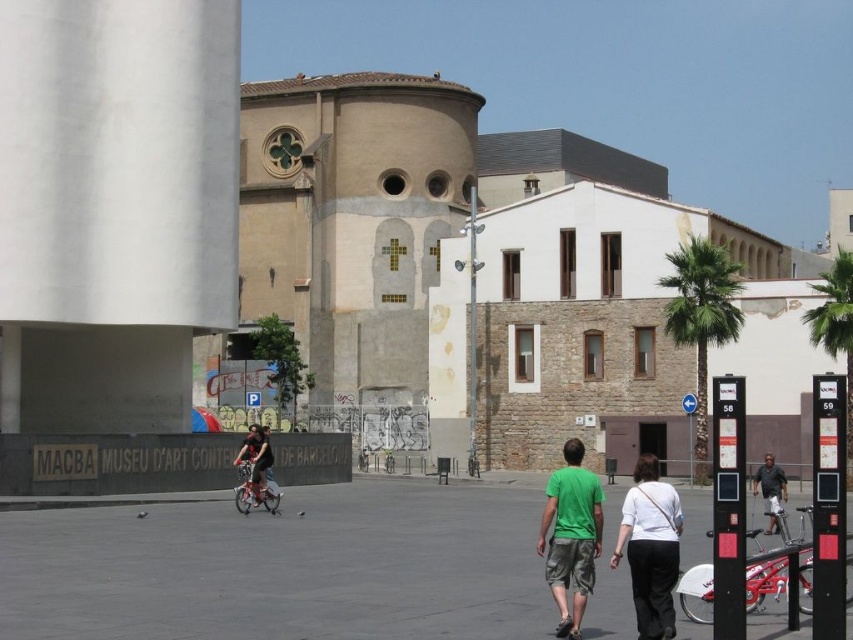
Question: Which point is closer to the camera?

Choices:
 (A) (567, 461)
 (B) (770, 502)
 (C) (257, 456)

Answer: (A)

Question: Which of the following is the closest to the observer?

Choices:
 (A) (653, 627)
 (B) (769, 522)
 (C) (583, 593)

Answer: (A)

Question: Can you confirm if white cotton shirt at center is thinner than matte black bicycle at center?

Choices:
 (A) no
 (B) yes

Answer: (B)

Question: Based on their relative distances, which object is nearer to the matte black bicycle at center?

Choices:
 (A) white cotton shirt at center
 (B) green matte t-shirt at center

Answer: (B)

Question: Does white cotton shirt at center have a larger size compared to green matte t-shirt at center?

Choices:
 (A) yes
 (B) no

Answer: (A)

Question: Does white cotton shirt at center have a larger size compared to matte black bicycle at center?

Choices:
 (A) no
 (B) yes

Answer: (B)